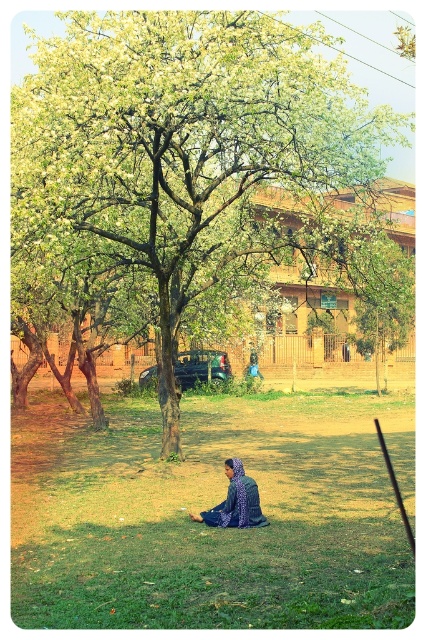
Question: Can you confirm if green leafy tree at center is smaller than blue patterned dress at center?

Choices:
 (A) yes
 (B) no

Answer: (B)

Question: Which of the following is the farthest from the observer?

Choices:
 (A) blue patterned dress at center
 (B) green leafy tree at center

Answer: (B)

Question: Which point is closer to the camera taking this photo?

Choices:
 (A) (229, 492)
 (B) (229, 120)

Answer: (A)

Question: Does green leafy tree at center appear over blue patterned dress at center?

Choices:
 (A) yes
 (B) no

Answer: (A)

Question: Which point appears farthest from the camera in this image?

Choices:
 (A) (144, 108)
 (B) (250, 493)

Answer: (A)

Question: Is green leafy tree at center below blue patterned dress at center?

Choices:
 (A) yes
 (B) no

Answer: (B)